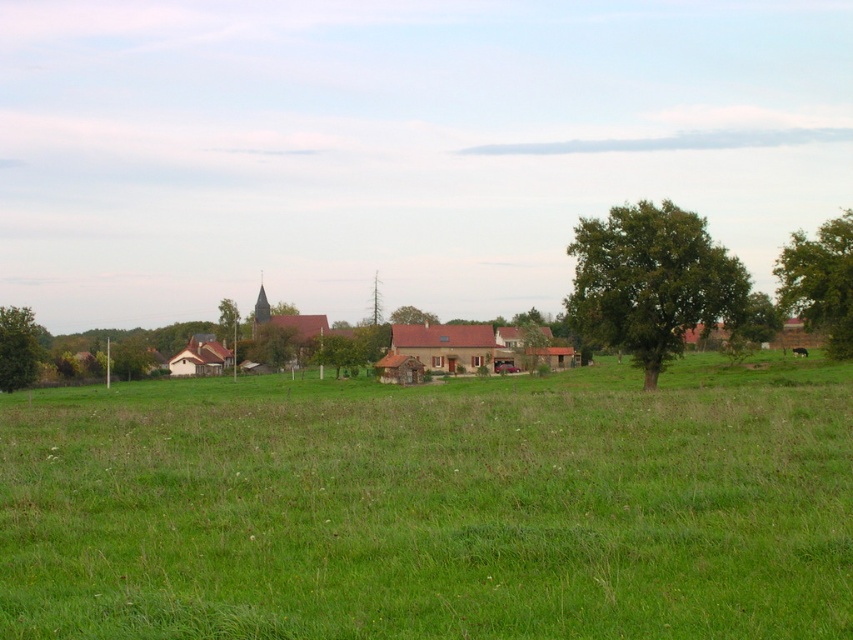
Between point (548, 417) and point (9, 314), which one is positioned in front?

Point (548, 417) is in front.

Does point (219, 456) lie in front of point (33, 332)?

Yes, point (219, 456) is closer to viewer.

Locate an element on the screen. green grass pasture at center is located at coordinates (433, 508).

Is the position of green grass pasture at center less distant than that of green leafy tree at center-right?

Yes, green grass pasture at center is closer to the viewer.

Describe the element at coordinates (433, 508) in the screenshot. I see `green grass pasture at center` at that location.

Between point (776, 364) and point (729, 308), which one is positioned behind?

Positioned behind is point (776, 364).

Locate an element on the screen. The width and height of the screenshot is (853, 640). green grass pasture at center is located at coordinates (433, 508).

Can you confirm if green leafy tree at right is smaller than green leafy tree at center?

Result: No.

Between point (831, 227) and point (405, 323), which one is positioned behind?

The point (405, 323) is behind.

Who is more distant from viewer, (843, 253) or (396, 321)?

The point (396, 321) is behind.

Identify the location of green leafy tree at right. This screenshot has height=640, width=853. point(820,282).